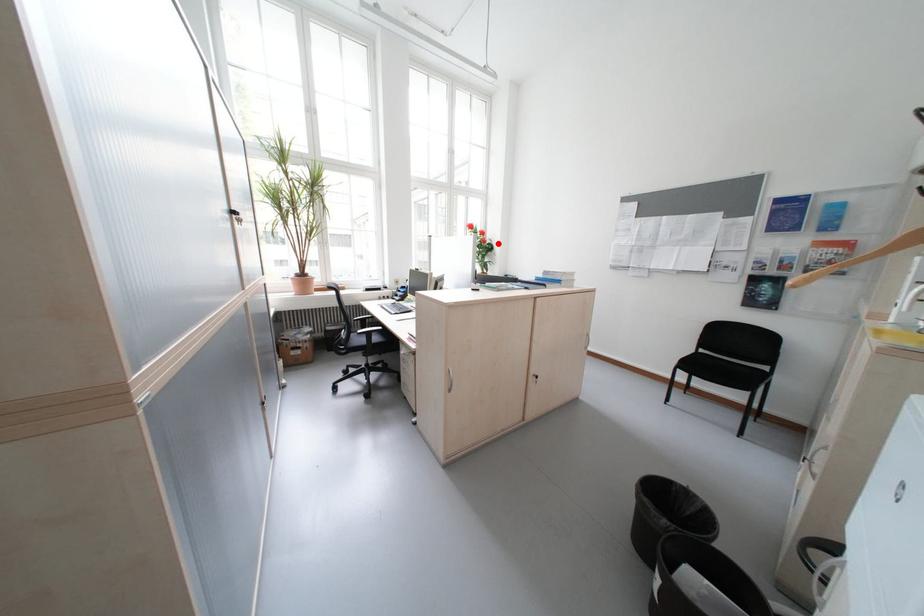
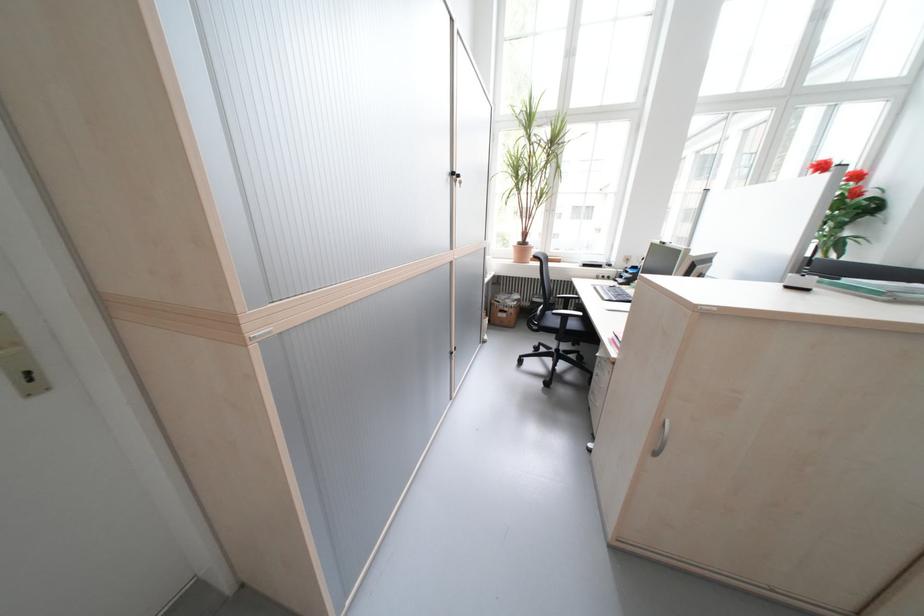
In the second image, find the point that corresponds to the highlighted location in the first image.

(881, 196)